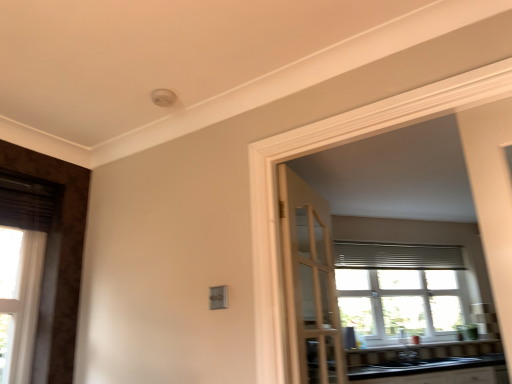
Question: Is white glass window at center positioned beyond the bounds of silver metallic blinds at upper center?

Choices:
 (A) yes
 (B) no

Answer: (A)

Question: Considering the relative sizes of white glass window at center and silver metallic blinds at upper center in the image provided, is white glass window at center bigger than silver metallic blinds at upper center?

Choices:
 (A) no
 (B) yes

Answer: (B)

Question: From the image's perspective, does white glass window at center appear lower than silver metallic blinds at upper center?

Choices:
 (A) yes
 (B) no

Answer: (A)

Question: Does white glass window at center have a lesser height compared to silver metallic blinds at upper center?

Choices:
 (A) no
 (B) yes

Answer: (A)

Question: Does white glass window at center appear on the right side of silver metallic blinds at upper center?

Choices:
 (A) no
 (B) yes

Answer: (A)

Question: Would you say silver metallic blinds at upper center is part of white glass window at center's contents?

Choices:
 (A) yes
 (B) no

Answer: (B)

Question: Is silver metallic blinds at upper center further to the viewer compared to black glossy sink at lower center, which is the 2th sink in left-to-right order?

Choices:
 (A) no
 (B) yes

Answer: (B)

Question: Does silver metallic blinds at upper center appear on the right side of black glossy sink at lower center, the first sink positioned from the right?

Choices:
 (A) no
 (B) yes

Answer: (B)

Question: Could you tell me if silver metallic blinds at upper center is facing black glossy sink at lower center, which is the 2th sink in left-to-right order?

Choices:
 (A) yes
 (B) no

Answer: (B)

Question: Is silver metallic blinds at upper center thinner than black glossy sink at lower center, the first sink positioned from the right?

Choices:
 (A) no
 (B) yes

Answer: (B)

Question: Considering the relative sizes of silver metallic blinds at upper center and black glossy sink at lower center, the first sink positioned from the right, in the image provided, is silver metallic blinds at upper center shorter than black glossy sink at lower center, the first sink positioned from the right,?

Choices:
 (A) no
 (B) yes

Answer: (A)

Question: From the image's perspective, is silver metallic blinds at upper center on top of black glossy sink at lower center, the first sink positioned from the right?

Choices:
 (A) no
 (B) yes

Answer: (B)

Question: Is black glossy sink at lower center, which is the 2th sink in left-to-right order, to the right of white wood door at left, which appears as the 2th door when viewed from the right, from the viewer's perspective?

Choices:
 (A) yes
 (B) no

Answer: (A)